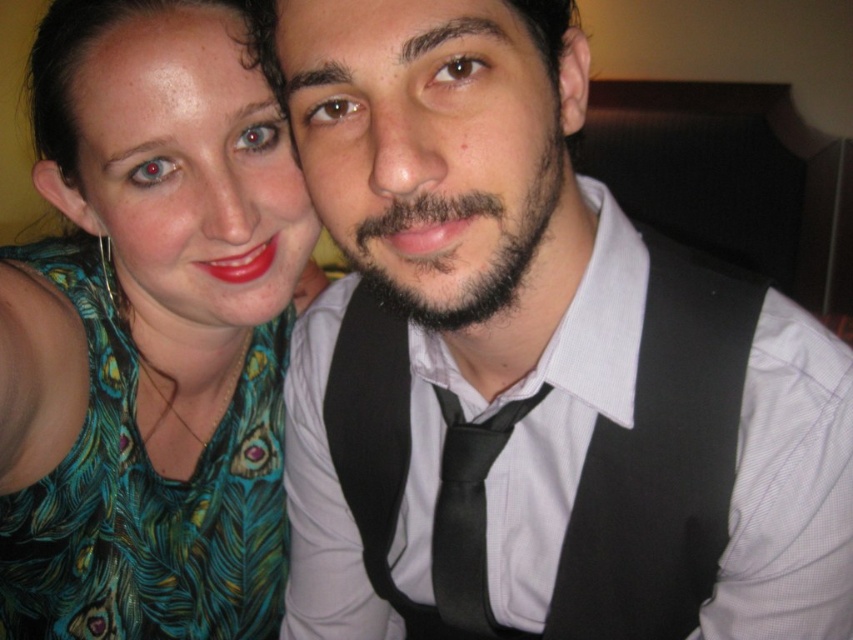
What do you see at coordinates (584, 456) in the screenshot? This screenshot has width=853, height=640. I see `black fabric vest at center` at bounding box center [584, 456].

Is point (680, 291) positioned after point (482, 595)?

No, it is in front of (482, 595).

Does point (625, 483) come farther from viewer compared to point (483, 522)?

No, (625, 483) is in front of (483, 522).

Locate an element on the screen. Image resolution: width=853 pixels, height=640 pixels. black fabric vest at center is located at coordinates (584, 456).

Consider the image. Does green feathered dress at left have a greater height compared to black satin tie at center?

Indeed, green feathered dress at left has a greater height compared to black satin tie at center.

This screenshot has width=853, height=640. What do you see at coordinates (149, 332) in the screenshot?
I see `green feathered dress at left` at bounding box center [149, 332].

What are the coordinates of `green feathered dress at left` in the screenshot? It's located at (149, 332).

Who is higher up, green feathered dress at left or black fabric vest at center?

green feathered dress at left is above.

Between green feathered dress at left and black fabric vest at center, which one appears on the right side from the viewer's perspective?

Positioned to the right is black fabric vest at center.

Who is more distant from viewer, (198, 525) or (613, 424)?

The point (198, 525) is more distant.

The image size is (853, 640). Identify the location of green feathered dress at left. (149, 332).